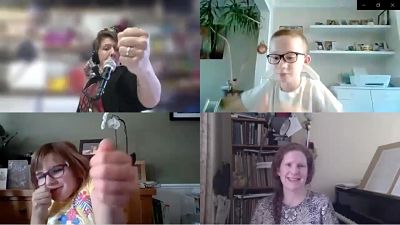
Where is `books`? This screenshot has width=400, height=225. books is located at coordinates (247, 134), (252, 174).